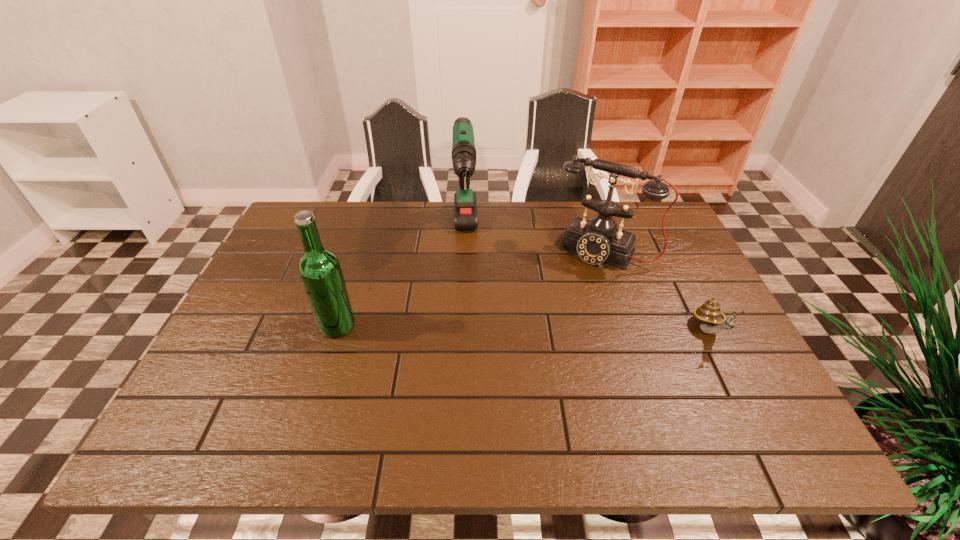
You are a GUI agent. You are given a task and a screenshot of the screen. Output one action in this format:
    pyautogui.click(x=<x>, y=<y>)
    Task: Click on the free space located on the handle side of the drill
    Image resolution: width=960 pixels, height=540 pixels.
    Given the screenshot: What is the action you would take?
    pyautogui.click(x=468, y=398)

Image resolution: width=960 pixels, height=540 pixels. In order to click on free location located 0.360m on the handle side of the drill in this screenshot , I will do `click(468, 389)`.

Find the location of `telephone located at the far edge`. telephone located at the far edge is located at coordinates (596, 241).

What are the coordinates of `drill present at the far edge` in the screenshot? It's located at (464, 155).

Find the location of a particular element. snail that is positioned at the right edge is located at coordinates (712, 320).

Where is `telephone that is at the right edge`? The width and height of the screenshot is (960, 540). telephone that is at the right edge is located at coordinates (596, 241).

Locate an element on the screen. The height and width of the screenshot is (540, 960). object that is positioned at the far right corner is located at coordinates (596, 241).

I want to click on vacant space at the far edge of the desktop, so click(562, 209).

In the image, there is a desktop. Where is `free region at the near edge`? The height and width of the screenshot is (540, 960). free region at the near edge is located at coordinates (x=287, y=379).

Image resolution: width=960 pixels, height=540 pixels. Identify the location of vacant space at the left edge of the desktop. (244, 332).